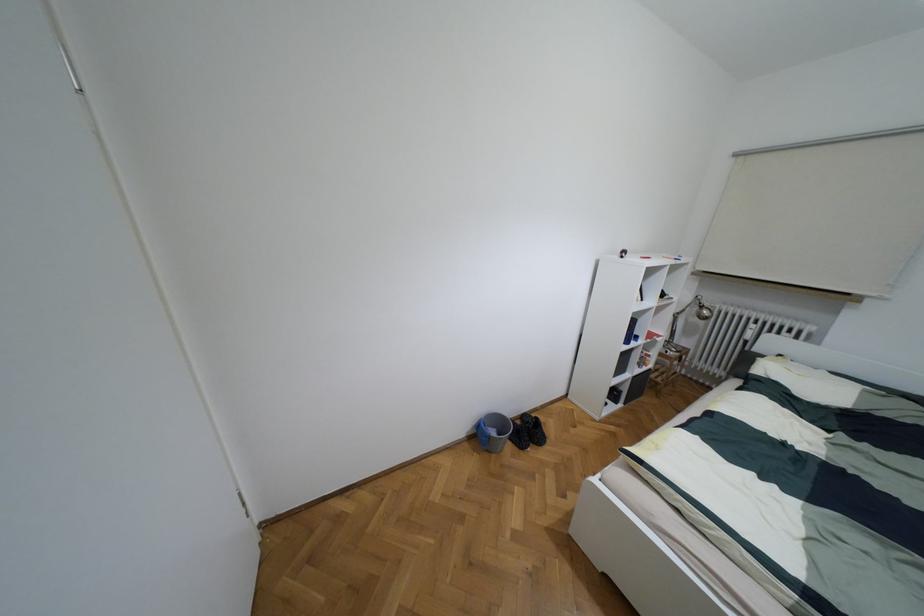
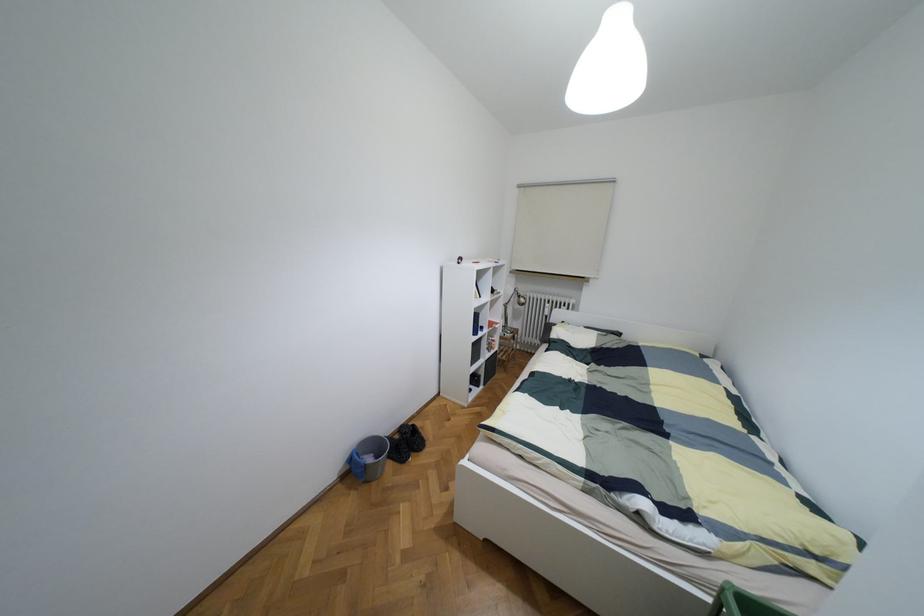
In the second image, find the point that corresponds to the point at 492,432 in the first image.

(369, 459)